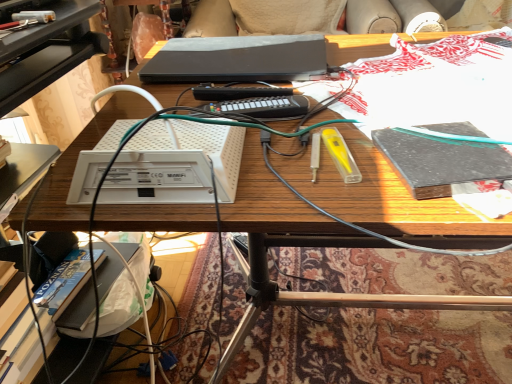
What do you see at coordinates (439, 163) in the screenshot?
I see `black matte book at right` at bounding box center [439, 163].

Measure the distance between point (177,55) and camera.

A distance of 35.08 inches exists between point (177,55) and camera.

Consider the image. What is the approximate width of white plastic router at center?

white plastic router at center is 7.19 inches wide.

The image size is (512, 384). In order to click on black matte book at right in this screenshot , I will do `click(439, 163)`.

From the image's perspective, is black matte book at right located above or below black matte laptop at center?

From the image's perspective, black matte book at right appears below black matte laptop at center.

Does black matte book at right have a greater width compared to black matte laptop at center?

No, black matte book at right is not wider than black matte laptop at center.

Image resolution: width=512 pixels, height=384 pixels. I want to click on book that appears below the black matte laptop at center (from a real-world perspective), so click(439, 163).

Which point is more distant from viewer, (227, 69) or (421, 137)?

Point (227, 69)

Between black matte laptop at center and black matte book at right, which one appears on the left side from the viewer's perspective?

From the viewer's perspective, black matte laptop at center appears more on the left side.

From the image's perspective, does black matte laptop at center appear lower than black matte book at right?

Incorrect, from the image's perspective, black matte laptop at center is higher than black matte book at right.

Who is bigger, black matte laptop at center or black matte book at right?

black matte laptop at center is bigger.

Which is closer, (199, 157) or (415, 138)?

Point (199, 157)

From a real-world perspective, is white plastic router at center located higher than black matte book at right?

Yes, from a real-world perspective, white plastic router at center is on top of black matte book at right.

From the picture: How different are the orientations of white plastic router at center and black matte book at right in degrees?

The angular difference between white plastic router at center and black matte book at right is 7.63 degrees.

Considering the relative sizes of white plastic router at center and black matte book at right in the image provided, is white plastic router at center thinner than black matte book at right?

In fact, white plastic router at center might be wider than black matte book at right.

Considering the positions of point (420, 170) and point (195, 130), is point (420, 170) closer or farther from the camera than point (195, 130)?

Point (420, 170) appears to be farther away from the viewer than point (195, 130).

In the scene shown: Is black matte book at right wider than white plastic router at center?

In fact, black matte book at right might be narrower than white plastic router at center.

From a real-world perspective, is black matte book at right physically above white plastic router at center?

No, from a real-world perspective, black matte book at right is not on top of white plastic router at center.

Where is `book behind the white plastic router at center`? The height and width of the screenshot is (384, 512). book behind the white plastic router at center is located at coordinates (439, 163).

Consider the image. Looking at the image, does white plastic router at center seem bigger or smaller compared to black matte laptop at center?

In the image, white plastic router at center appears to be smaller than black matte laptop at center.

Can you confirm if white plastic router at center is positioned to the left of black matte laptop at center?

Indeed, white plastic router at center is positioned on the left side of black matte laptop at center.

Is white plastic router at center placed right next to black matte laptop at center?

white plastic router at center and black matte laptop at center are clearly separated.

Is white plastic router at center positioned beyond the bounds of black matte laptop at center?

white plastic router at center lies outside black matte laptop at center's area.

From the image's perspective, is black matte laptop at center located above or below white plastic router at center?

black matte laptop at center is above white plastic router at center.

Is black matte laptop at center in front of or behind white plastic router at center in the image?

black matte laptop at center is behind white plastic router at center.

Between black matte laptop at center and white plastic router at center, which one has smaller width?

Thinner between the two is white plastic router at center.

Find the location of a particular element. computer that is behind the white plastic router at center is located at coordinates (237, 59).

This screenshot has width=512, height=384. Identify the location of computer above the black matte book at right (from the image's perspective). (237, 59).

This screenshot has width=512, height=384. In order to click on computer to the left of black matte book at right in this screenshot , I will do `click(237, 59)`.

From the picture: Estimate the real-world distances between objects in this image. Which object is further from black matte laptop at center, white plastic router at center or black matte book at right?

black matte book at right lies further to black matte laptop at center than the other object.

Estimate the real-world distances between objects in this image. Which object is closer to black matte book at right, black matte laptop at center or white plastic router at center?

white plastic router at center is closer to black matte book at right.

Based on their spatial positions, is black matte book at right or white plastic router at center further from black matte laptop at center?

Among the two, black matte book at right is located further to black matte laptop at center.

From the image, which object appears to be nearer to white plastic router at center, black matte laptop at center or black matte book at right?

The object closer to white plastic router at center is black matte book at right.

Based on their spatial positions, is white plastic router at center or black matte laptop at center closer to black matte book at right?

white plastic router at center is positioned closer to the anchor black matte book at right.

Based on their spatial positions, is black matte book at right or black matte laptop at center further from white plastic router at center?

The object further to white plastic router at center is black matte laptop at center.

I want to click on computer located between white plastic router at center and black matte book at right in the left-right direction, so click(x=237, y=59).